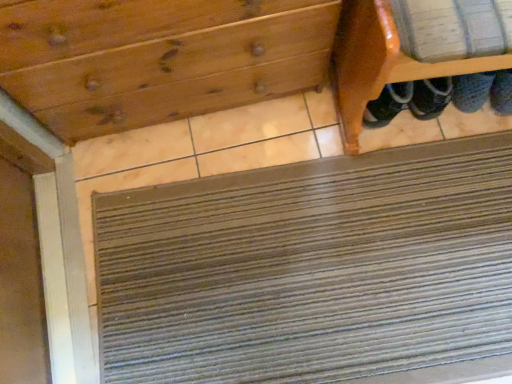
This screenshot has width=512, height=384. Find the location of `wooden drawer at upper center`. wooden drawer at upper center is located at coordinates (158, 59).

Find the location of `wooden shoe rack at upper right`. wooden shoe rack at upper right is located at coordinates pyautogui.click(x=378, y=63).

Find the location of a particular element. The height and width of the screenshot is (384, 512). brown textured mat at lower center is located at coordinates (311, 269).

Which is in front, point (453, 244) or point (456, 68)?

The point (456, 68) is in front.

Measure the distance between brown textured mat at lower center and wooden shoe rack at upper right.

brown textured mat at lower center is 15.68 inches away from wooden shoe rack at upper right.

From a real-world perspective, is brown textured mat at lower center located beneath wooden shoe rack at upper right?

Yes, from a real-world perspective, brown textured mat at lower center is beneath wooden shoe rack at upper right.

Is brown textured mat at lower center bigger than wooden shoe rack at upper right?

No.

Based on the photo, from the image's perspective, is wooden shoe rack at upper right positioned above or below brown textured mat at lower center?

Based on their image positions, wooden shoe rack at upper right is located above brown textured mat at lower center.

In the image, there is a wooden shoe rack at upper right. At what (x,y) coordinates should I click in order to perform the action: click on doormat below it (from a real-world perspective). Please return your answer as a coordinate pair (x, y). The height and width of the screenshot is (384, 512). Looking at the image, I should click on (311, 269).

Consider the image. Is wooden shoe rack at upper right facing towards brown textured mat at lower center?

Yes, wooden shoe rack at upper right is aimed at brown textured mat at lower center.

Does wooden shoe rack at upper right come behind wooden drawer at upper center?

No.

Is wooden shoe rack at upper right placed right next to wooden drawer at upper center?

There is a gap between wooden shoe rack at upper right and wooden drawer at upper center.

In terms of size, does wooden shoe rack at upper right appear bigger or smaller than wooden drawer at upper center?

Considering their sizes, wooden shoe rack at upper right takes up less space than wooden drawer at upper center.

Would you say wooden shoe rack at upper right is outside wooden drawer at upper center?

That's correct, wooden shoe rack at upper right is outside of wooden drawer at upper center.

Is brown textured mat at lower center facing away from wooden drawer at upper center?

Yes, brown textured mat at lower center is positioned with its back facing wooden drawer at upper center.

Visually, is brown textured mat at lower center positioned to the left or to the right of wooden drawer at upper center?

From the image, it's evident that brown textured mat at lower center is to the right of wooden drawer at upper center.

Based on the photo, which of these two, brown textured mat at lower center or wooden drawer at upper center, is wider?

With larger width is brown textured mat at lower center.

In the scene shown: Can you confirm if wooden drawer at upper center is bigger than brown textured mat at lower center?

Yes.

Is point (151, 49) less distant than point (213, 373)?

Yes, point (151, 49) is closer to viewer.

Which object is thinner, wooden drawer at upper center or brown textured mat at lower center?

Thinner between the two is wooden drawer at upper center.

How different are the orientations of wooden drawer at upper center and wooden shoe rack at upper right in degrees?

The angle between the facing direction of wooden drawer at upper center and the facing direction of wooden shoe rack at upper right is 6 degrees.

Can you confirm if wooden drawer at upper center is shorter than wooden shoe rack at upper right?

No, wooden drawer at upper center is not shorter than wooden shoe rack at upper right.

Is wooden drawer at upper center wider or thinner than wooden shoe rack at upper right?

In the image, wooden drawer at upper center appears to be more narrow than wooden shoe rack at upper right.

Locate an element on the screen. This screenshot has height=384, width=512. furniture in front of the brown textured mat at lower center is located at coordinates (378, 63).

In the image, there is a wooden shoe rack at upper right. Identify the location of doormat below it (from the image's perspective). This screenshot has width=512, height=384. (311, 269).

Looking at the image, which one is located further to wooden shoe rack at upper right, wooden drawer at upper center or brown textured mat at lower center?

The object further to wooden shoe rack at upper right is brown textured mat at lower center.

When comparing their distances from brown textured mat at lower center, does wooden shoe rack at upper right or wooden drawer at upper center seem closer?

wooden shoe rack at upper right is positioned closer to the anchor brown textured mat at lower center.

Based on their spatial positions, is brown textured mat at lower center or wooden drawer at upper center further from wooden shoe rack at upper right?

brown textured mat at lower center is positioned further to the anchor wooden shoe rack at upper right.

Based on their spatial positions, is wooden drawer at upper center or wooden shoe rack at upper right closer to brown textured mat at lower center?

wooden shoe rack at upper right is positioned closer to the anchor brown textured mat at lower center.

Estimate the real-world distances between objects in this image. Which object is closer to wooden drawer at upper center, brown textured mat at lower center or wooden shoe rack at upper right?

wooden shoe rack at upper right is closer to wooden drawer at upper center.

Based on their spatial positions, is wooden shoe rack at upper right or brown textured mat at lower center closer to wooden drawer at upper center?

wooden shoe rack at upper right.

The height and width of the screenshot is (384, 512). What are the coordinates of `furniture between wooden drawer at upper center and brown textured mat at lower center vertically` in the screenshot? It's located at (378, 63).